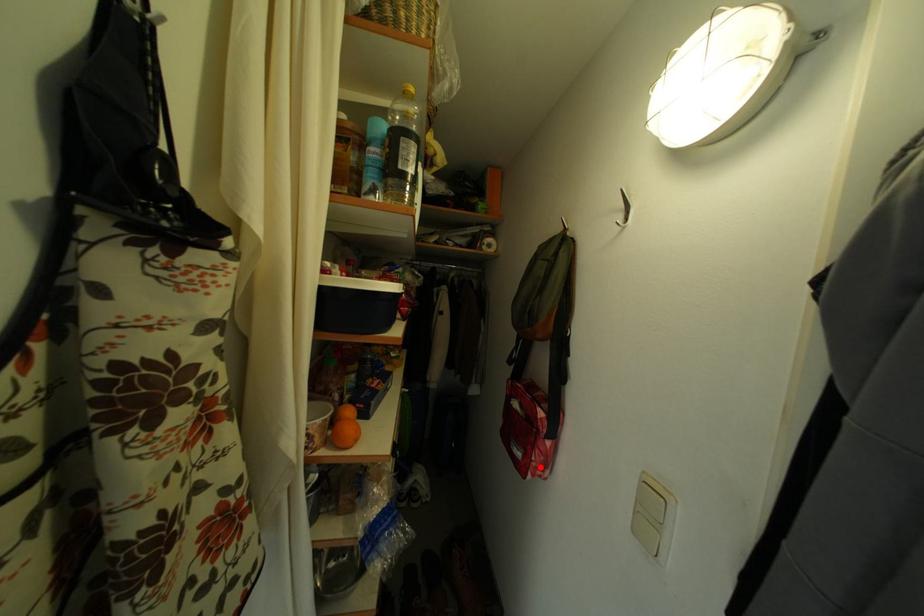
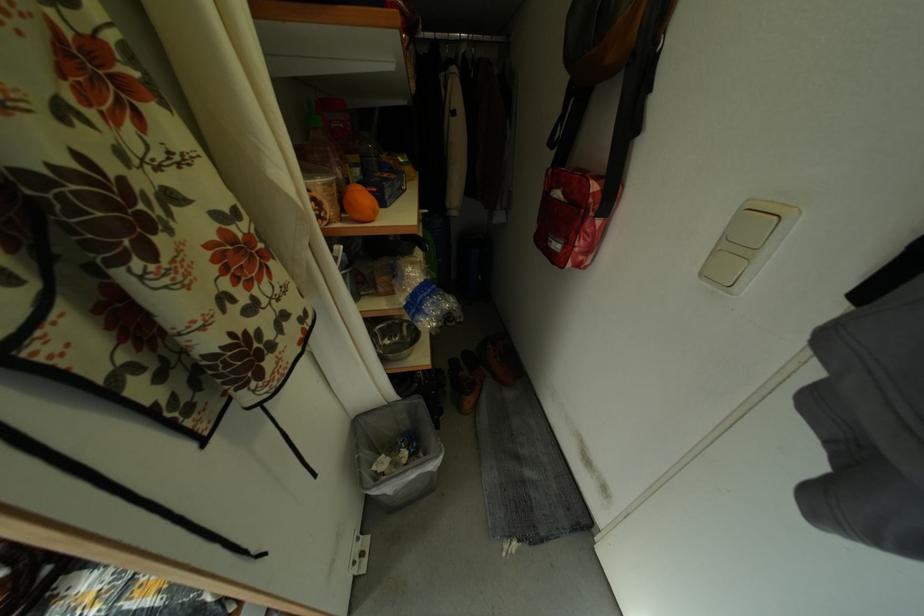
Find the pixel in the second image that matches the highlighted location in the first image.

(584, 253)